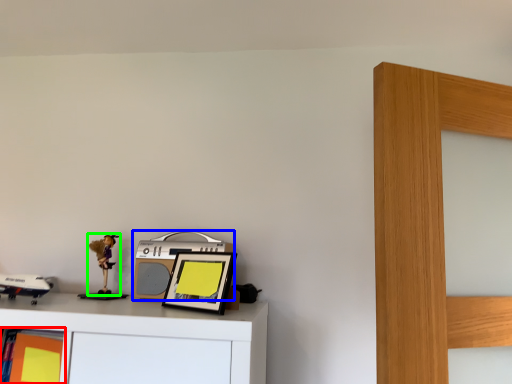
Question: Which object is the farthest from shelf (highlighted by a red box)? Choose among these: stereo (highlighted by a blue box) or toy (highlighted by a green box).

Choices:
 (A) stereo
 (B) toy

Answer: (A)